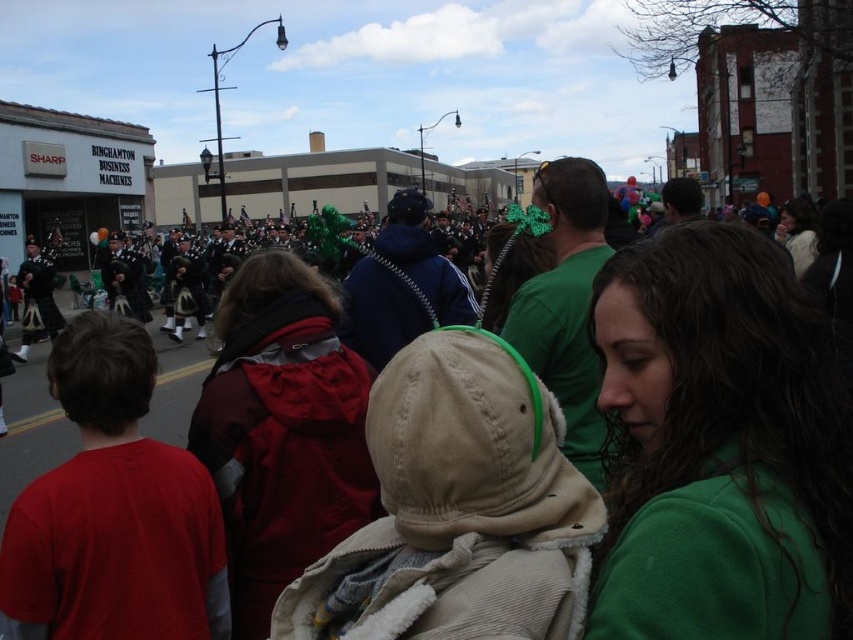
You are standing at the point marked as point (796, 634) and want to reach a friend located at point 0.934. The distance between these two points is 62.07 feet. If you walk at a speed of 3 feet per second, how many seconds will it take you to reach your friend?

The distance between point (796, 634) and point 0.934 is 62.07 feet. At a walking speed of 3 feet per second, it will take 62.07 divided by 3, which equals approximately 20.69 seconds to reach your friend.

You are a photographer at the parade. You want to take a photo that includes both the green fleece jacket at center and the red cotton shirt at center. Which one should you focus on first to ensure both are in the frame?

The green fleece jacket at center is above the red cotton shirt at center, so you should focus on the red cotton shirt at center first to ensure both are in the frame.